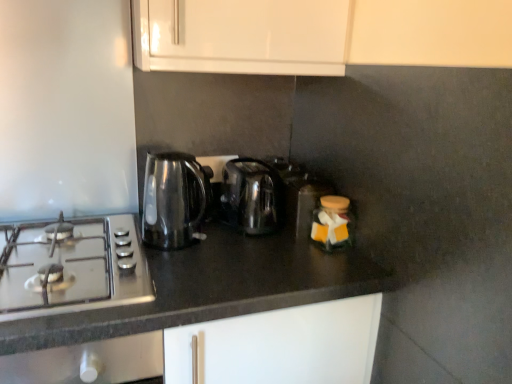
Question: Can you confirm if black granite countertop at center is smaller than satin silver gas stove at left?

Choices:
 (A) yes
 (B) no

Answer: (B)

Question: Can you confirm if black granite countertop at center is positioned to the left of satin silver gas stove at left?

Choices:
 (A) yes
 (B) no

Answer: (B)

Question: Does black granite countertop at center have a lesser width compared to satin silver gas stove at left?

Choices:
 (A) yes
 (B) no

Answer: (B)

Question: Is black granite countertop at center positioned with its back to satin silver gas stove at left?

Choices:
 (A) yes
 (B) no

Answer: (B)

Question: Can you confirm if black granite countertop at center is shorter than satin silver gas stove at left?

Choices:
 (A) no
 (B) yes

Answer: (A)

Question: Looking at the image, does stainless steel kettle at center, which is the second kitchen appliance from left to right, seem bigger or smaller compared to translucent plastic container at center, positioned as the first appliance in back-to-front order?

Choices:
 (A) small
 (B) big

Answer: (B)

Question: Looking at their shapes, would you say stainless steel kettle at center, which is the second kitchen appliance from left to right, is wider or thinner than translucent plastic container at center, positioned as the first appliance in back-to-front order?

Choices:
 (A) thin
 (B) wide

Answer: (B)

Question: Relative to translucent plastic container at center, arranged as the second appliance when viewed from the front, is stainless steel kettle at center, the 1th kitchen appliance viewed from the right, in front or behind?

Choices:
 (A) front
 (B) behind

Answer: (A)

Question: Would you say stainless steel kettle at center, the 1th kitchen appliance viewed from the right, is inside or outside translucent plastic container at center, arranged as the second appliance when viewed from the front?

Choices:
 (A) outside
 (B) inside

Answer: (A)

Question: Based on their positions, is translucent plastic container at center, arranged as the second appliance when viewed from the front, located to the left or right of satin silver gas stove at left?

Choices:
 (A) right
 (B) left

Answer: (A)

Question: Considering the positions of point (294, 188) and point (32, 274), is point (294, 188) closer or farther from the camera than point (32, 274)?

Choices:
 (A) closer
 (B) farther

Answer: (B)

Question: From a real-world perspective, relative to satin silver gas stove at left, is translucent plastic container at center, arranged as the second appliance when viewed from the front, vertically above or below?

Choices:
 (A) below
 (B) above

Answer: (B)

Question: From the image's perspective, relative to satin silver gas stove at left, is translucent plastic container at center, positioned as the first appliance in back-to-front order, above or below?

Choices:
 (A) below
 (B) above

Answer: (B)

Question: Is transparent glass kettle at left, which ranks as the 2th kitchen appliance in right-to-left order, situated inside matte glass jar at center right, marked as the 1th appliance in a front-to-back arrangement, or outside?

Choices:
 (A) inside
 (B) outside

Answer: (B)

Question: Is transparent glass kettle at left, which ranks as the 2th kitchen appliance in right-to-left order, to the left or to the right of matte glass jar at center right, marked as the 1th appliance in a front-to-back arrangement, in the image?

Choices:
 (A) right
 (B) left

Answer: (B)